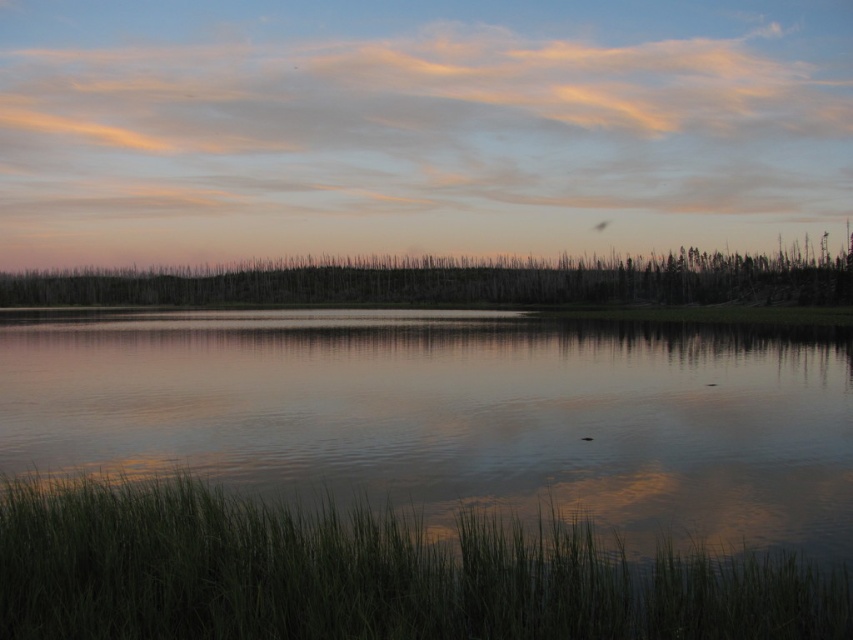
Looking at this image, which is more to the right, pastel cotton clouds at upper center or silhouetted dead trees at center?

From the viewer's perspective, pastel cotton clouds at upper center appears more on the right side.

Consider the image. Is pastel cotton clouds at upper center shorter than silhouetted dead trees at center?

In fact, pastel cotton clouds at upper center may be taller than silhouetted dead trees at center.

Identify the location of pastel cotton clouds at upper center. (418, 124).

Is point (486, 420) closer to viewer compared to point (756, 106)?

Yes.

Does transparent water at center appear on the right side of pastel cotton clouds at upper center?

Yes, transparent water at center is to the right of pastel cotton clouds at upper center.

Between point (241, 452) and point (782, 172), which one is positioned behind?

The point (782, 172) is behind.

Locate an element on the screen. The width and height of the screenshot is (853, 640). transparent water at center is located at coordinates (454, 416).

Does point (389, 348) come in front of point (260, 296)?

That is True.

Image resolution: width=853 pixels, height=640 pixels. Describe the element at coordinates (454, 416) in the screenshot. I see `transparent water at center` at that location.

Is point (563, 417) more distant than point (242, 296)?

No, (563, 417) is closer to viewer.

At what (x,y) coordinates should I click in order to perform the action: click on transparent water at center. Please return your answer as a coordinate pair (x, y). Looking at the image, I should click on (454, 416).